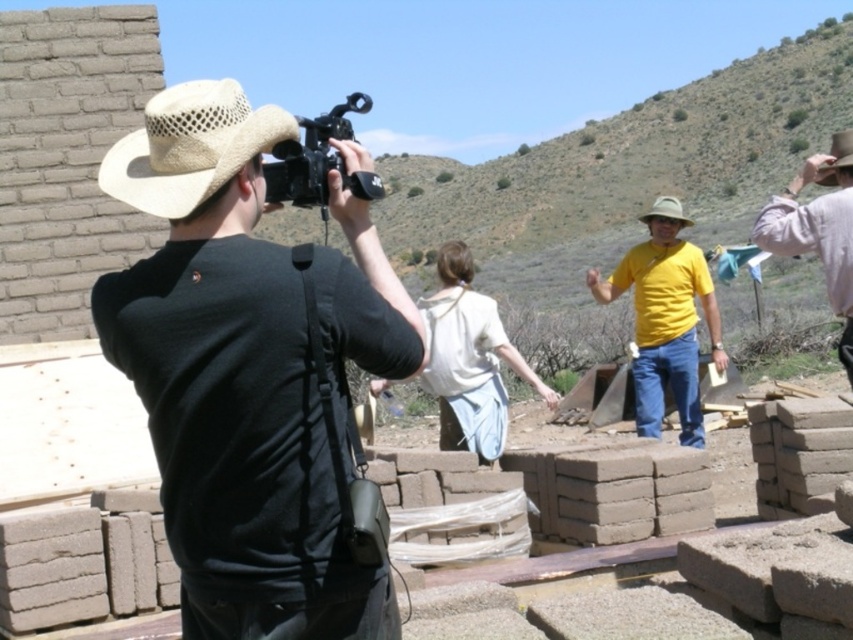
You are a photographer trying to decide which item to place in your bag first. Given the matte black camera at upper center and the light brown straw cowboy hat at center, which one is narrower in width?

The matte black camera at upper center is thinner than the light brown straw cowboy hat at center, so it is narrower in width.

You are a photographer trying to capture both the matte straw hat at center and the beige straw hat at upper left in a single shot. Which hat should you position closer to the camera to ensure both hats appear similar in size in the photo?

To make both hats appear similar in size in the photo, position the matte straw hat at center closer to the camera since it has a smaller width than the beige straw hat at upper left. This adjustment will help balance their apparent sizes due to the difference in their actual sizes.